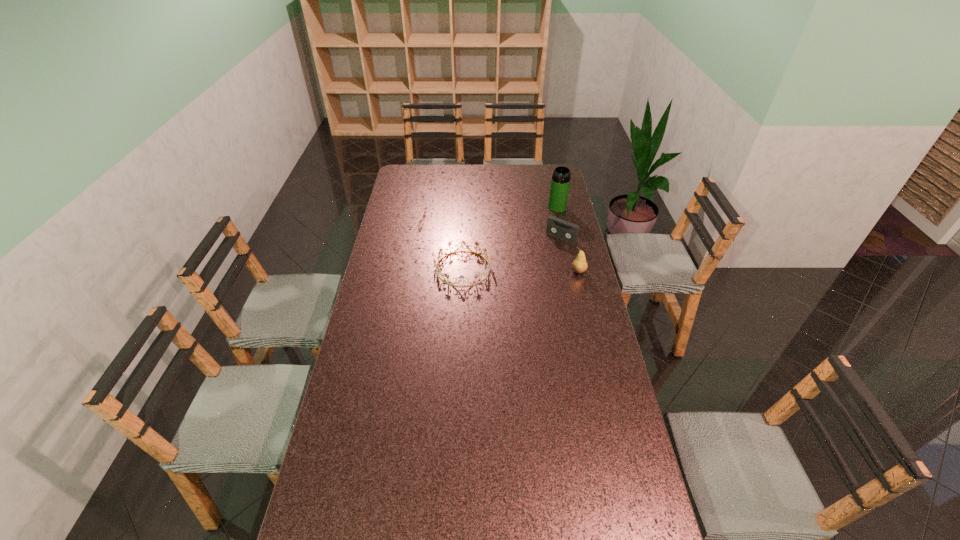
Where is `free spot on the desktop that is between the tiara and the third shortest object and is positioned from the spout of the farthest object`? free spot on the desktop that is between the tiara and the third shortest object and is positioned from the spout of the farthest object is located at coordinates (x=536, y=270).

The image size is (960, 540). In order to click on vacant space on the desktop that is between the leftmost object and the pear and is positioned on the front-facing side of the second farthest object in this screenshot , I will do `click(532, 270)`.